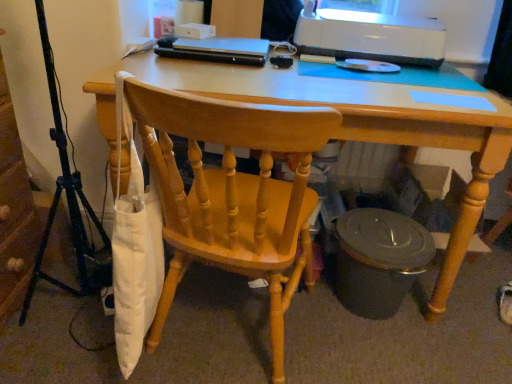
Find the location of a particular element. vacant space underneath metallic tripod at left (from a real-world perspective) is located at coordinates (67, 321).